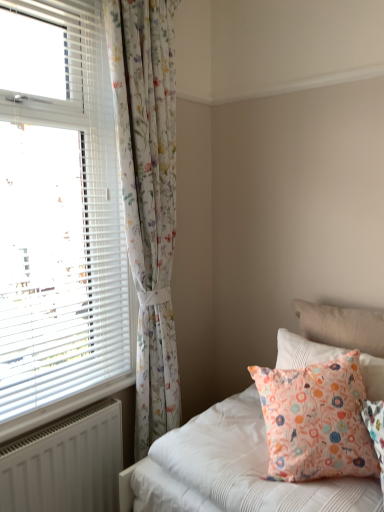
Question: Considering the positions of floral fabric pillow at upper right, which is counted as the 2th pillow, starting from the front, and white plastic radiator at lower left in the image, is floral fabric pillow at upper right, which is counted as the 2th pillow, starting from the front, taller or shorter than white plastic radiator at lower left?

Choices:
 (A) short
 (B) tall

Answer: (B)

Question: Is floral fabric pillow at upper right, which is counted as the 2th pillow, starting from the front, bigger or smaller than white plastic radiator at lower left?

Choices:
 (A) small
 (B) big

Answer: (B)

Question: Which object is the farthest from the white plastic radiator at lower left?

Choices:
 (A) white plastic blinds at left
 (B) peach fabric pillow at lower right, which is the second pillow in back-to-front order
 (C) floral fabric pillow at upper right, which is counted as the 2th pillow, starting from the front
 (D) white matte radiator at lower left

Answer: (C)

Question: Which of these objects is positioned closest to the white plastic blinds at left?

Choices:
 (A) white plastic radiator at lower left
 (B) peach fabric pillow at lower right, which is the second pillow in back-to-front order
 (C) white matte radiator at lower left
 (D) floral fabric pillow at upper right, the first pillow viewed from the back

Answer: (C)